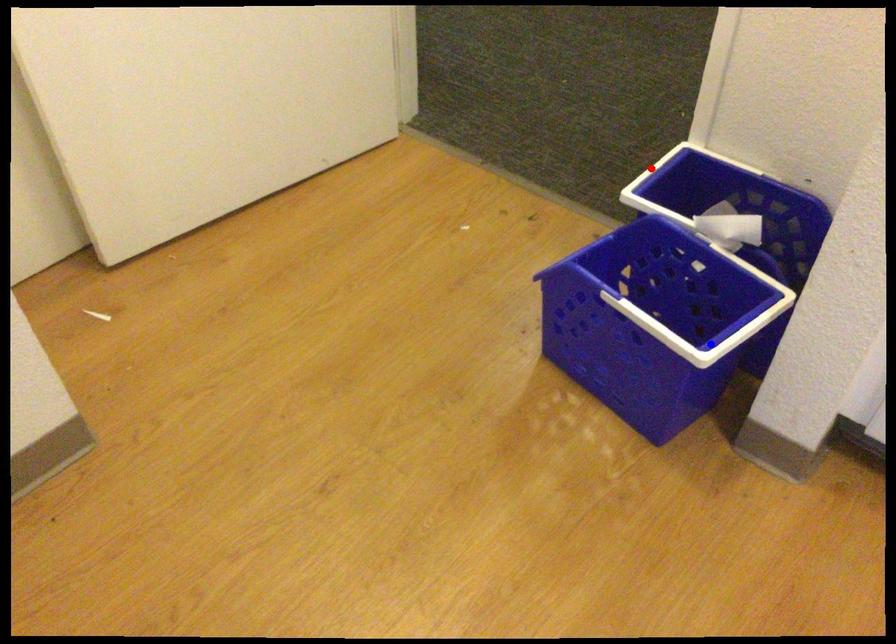
Question: Two points are marked on the image. Which point is closer to the camera?

Choices:
 (A) Blue point is closer.
 (B) Red point is closer.

Answer: (A)